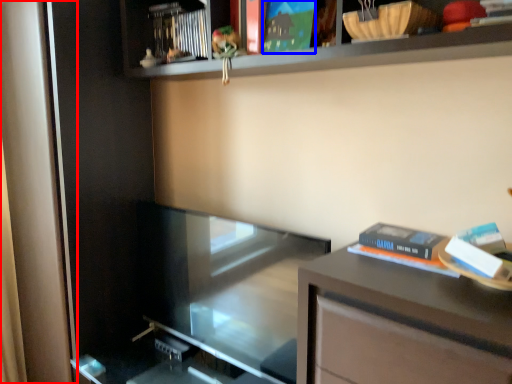
Question: Which point is closer to the camera, screen door (highlighted by a red box) or paperback book (highlighted by a blue box)?

Choices:
 (A) screen door
 (B) paperback book

Answer: (B)